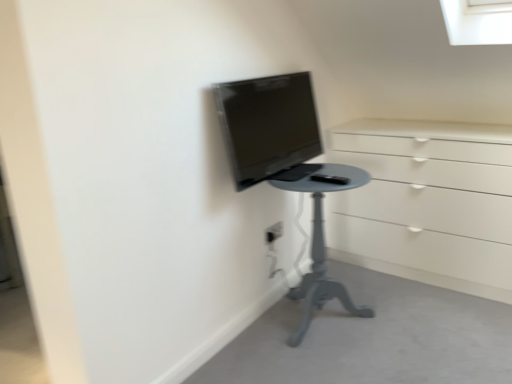
Locate an element on the screen. The image size is (512, 384). free space underneath matte gray table at center (from a real-world perspective) is located at coordinates (325, 319).